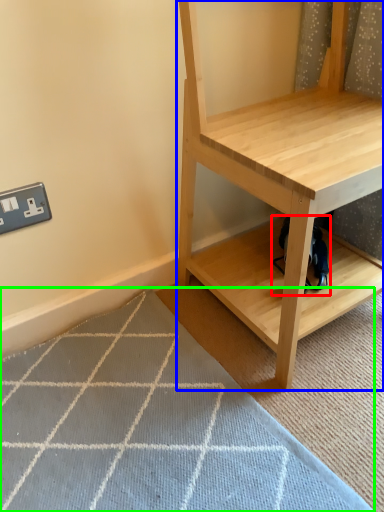
Question: Considering the real-world distances, which object is closest to swivel chair (highlighted by a red box)? shelf (highlighted by a blue box) or doormat (highlighted by a green box).

Choices:
 (A) shelf
 (B) doormat

Answer: (A)